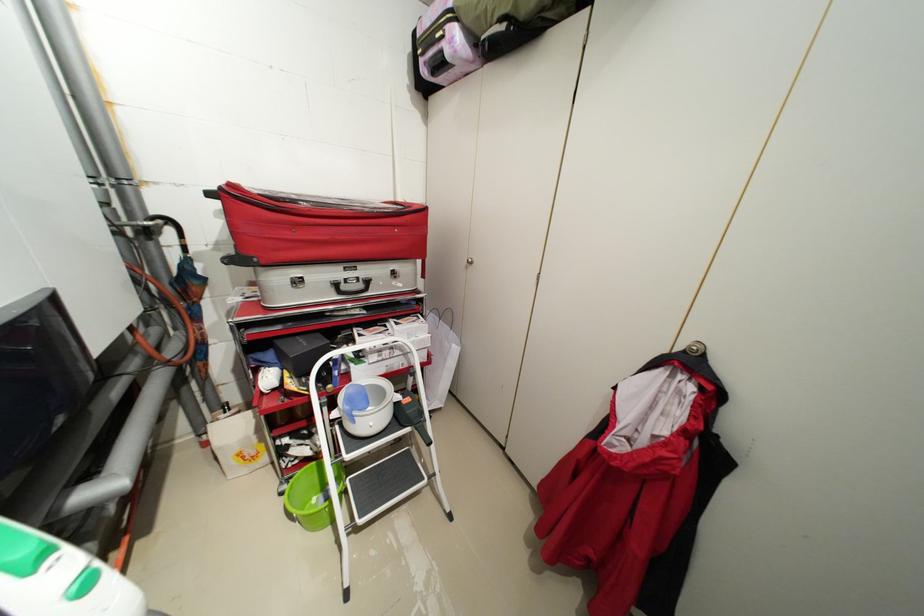
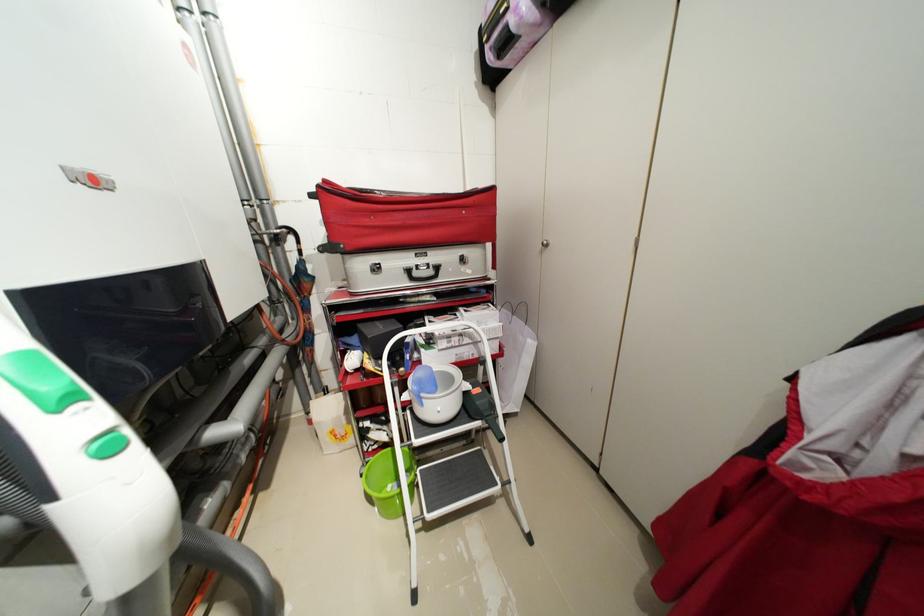
Where in the second image is the point corresponding to (x=237, y=185) from the first image?

(332, 182)